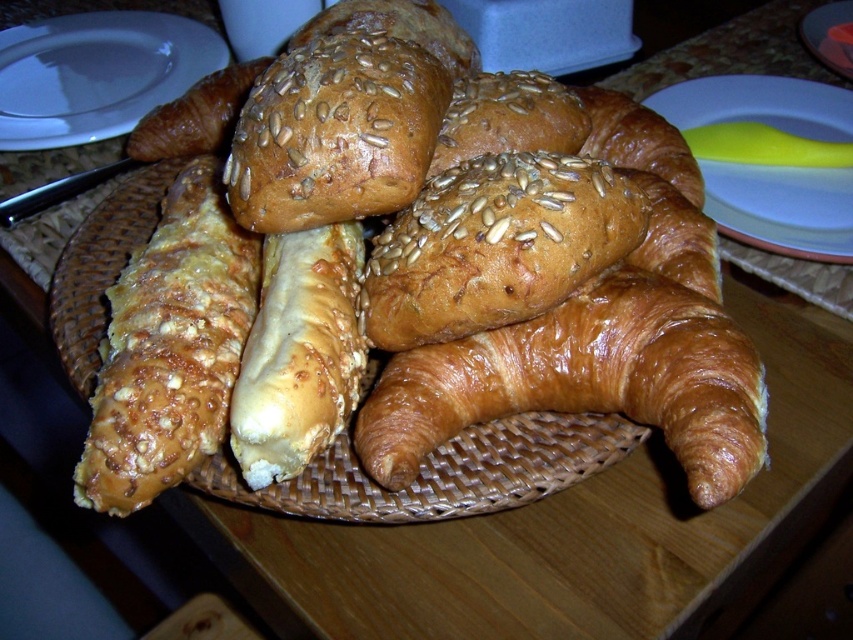
You are a baker who needs to place the shiny golden croissant at center onto the white ceramic plate at upper left. Based on their sizes, will the croissant fit on the plate?

The shiny golden croissant at center has a smaller size compared to the white ceramic plate at upper left, so it should fit comfortably on the plate.

You are arranging a breakfast spread and need to place a syrup bottle between the shiny golden croissant at center and the white ceramic plate at upper left. Where should you place the syrup bottle relative to the croissant?

The syrup bottle should be placed between the shiny golden croissant at center and the white ceramic plate at upper left, as the croissant is in front of the plate, so the syrup bottle should be positioned in front of the croissant and closer to the plate.

You are a baker who needs to retrieve the shiny golden croissant at center from the basket. If your hand can reach up to 25 inches, will you be able to grab it without moving the basket?

The shiny golden croissant at center is 25.51 inches away from the camera, so your hand can only reach up to 25 inches. Therefore, you cannot grab the shiny golden croissant at center without moving the basket.